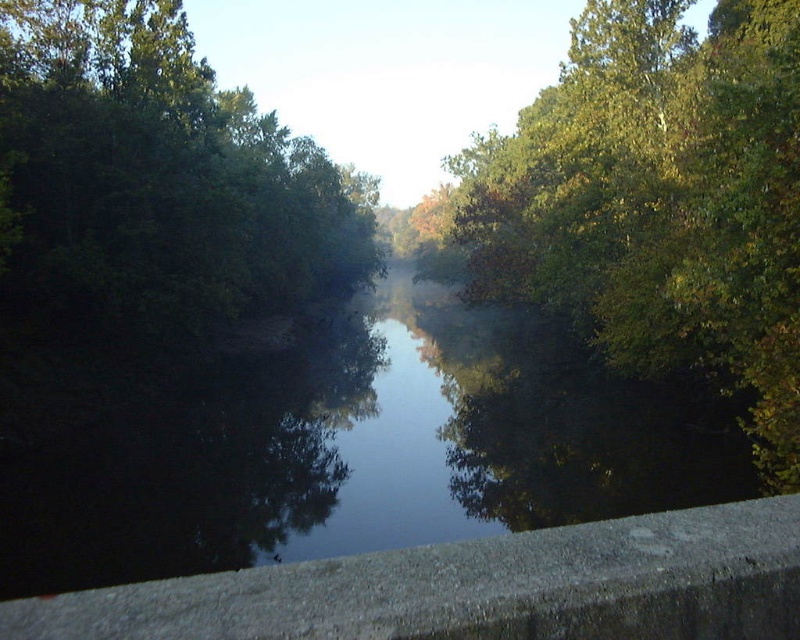
Is green leafy tree at upper right bigger than gray concrete ledge at lower center?

Correct, green leafy tree at upper right is larger in size than gray concrete ledge at lower center.

Does green leafy tree at upper right have a lesser width compared to gray concrete ledge at lower center?

No.

Where is `green leafy tree at upper right`? The image size is (800, 640). green leafy tree at upper right is located at coordinates (660, 202).

The height and width of the screenshot is (640, 800). In order to click on green leafy tree at upper right in this screenshot , I will do `click(660, 202)`.

Can you confirm if dark reflective water at center is positioned to the right of gray concrete ledge at lower center?

Indeed, dark reflective water at center is positioned on the right side of gray concrete ledge at lower center.

Is dark reflective water at center further to camera compared to gray concrete ledge at lower center?

Yes, dark reflective water at center is further from the viewer.

Describe the element at coordinates (362, 451) in the screenshot. I see `dark reflective water at center` at that location.

You are a GUI agent. You are given a task and a screenshot of the screen. Output one action in this format:
    pyautogui.click(x=<x>, y=<y>)
    Task: Click on the dark reflective water at center
    This screenshot has height=640, width=800.
    Given the screenshot: What is the action you would take?
    pyautogui.click(x=362, y=451)

Which is behind, point (692, 282) or point (256, 173)?

The point (256, 173) is more distant.

Is green leafy tree at upper right taller than green leafy tree at left?

No.

This screenshot has height=640, width=800. Find the location of `green leafy tree at upper right`. green leafy tree at upper right is located at coordinates (660, 202).